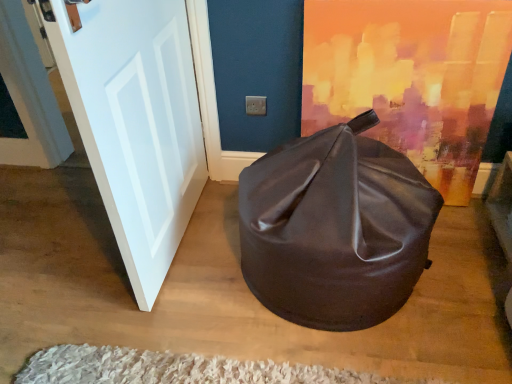
Where is `vacant region to the right of white glossy door at left`? This screenshot has width=512, height=384. vacant region to the right of white glossy door at left is located at coordinates (216, 239).